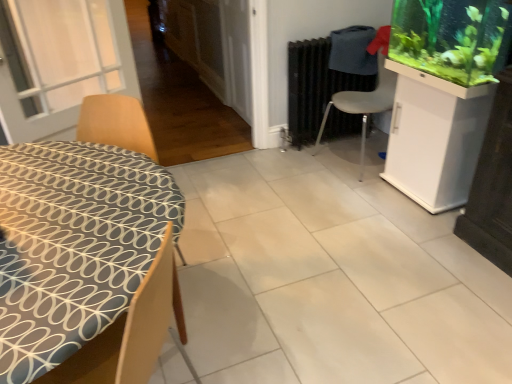
At what (x,y) coordinates should I click in order to perform the action: click on vacant space underneath black matte radiator at center (from a real-world perspective). Please return your answer as a coordinate pair (x, y). The image size is (512, 384). Looking at the image, I should click on (329, 135).